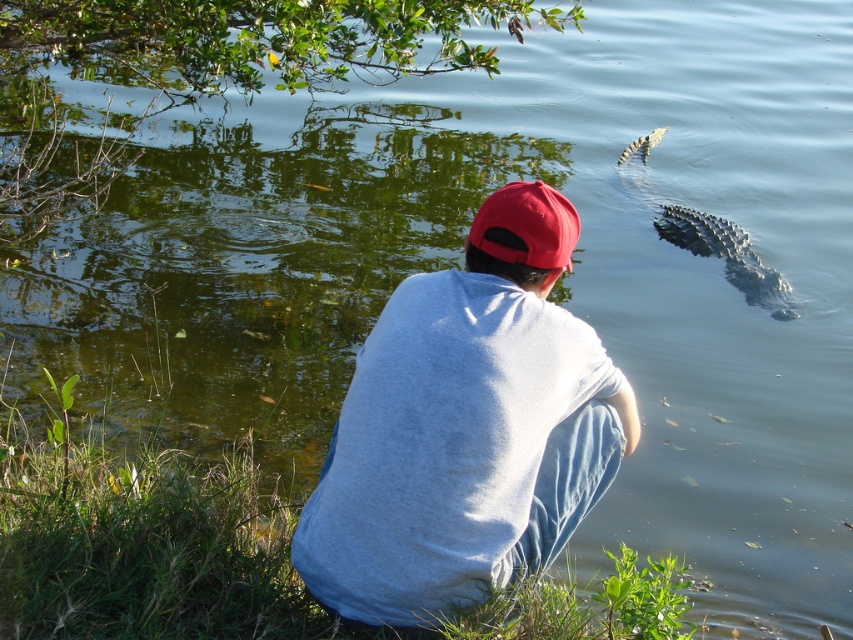
Question: Which point is farther to the camera?

Choices:
 (A) gray scaly crocodile at upper right
 (B) gray cotton shirt at center

Answer: (A)

Question: Does gray cotton shirt at center have a larger size compared to gray scaly crocodile at upper right?

Choices:
 (A) no
 (B) yes

Answer: (A)

Question: Which of these objects is positioned farthest from the matte red cap at center?

Choices:
 (A) gray cotton shirt at center
 (B) gray scaly crocodile at upper right

Answer: (B)

Question: Is gray scaly crocodile at upper right further to camera compared to matte red cap at center?

Choices:
 (A) yes
 (B) no

Answer: (A)

Question: Is gray scaly crocodile at upper right wider than matte red cap at center?

Choices:
 (A) yes
 (B) no

Answer: (A)

Question: Which object is the closest to the gray cotton shirt at center?

Choices:
 (A) matte red cap at center
 (B) gray scaly crocodile at upper right

Answer: (A)